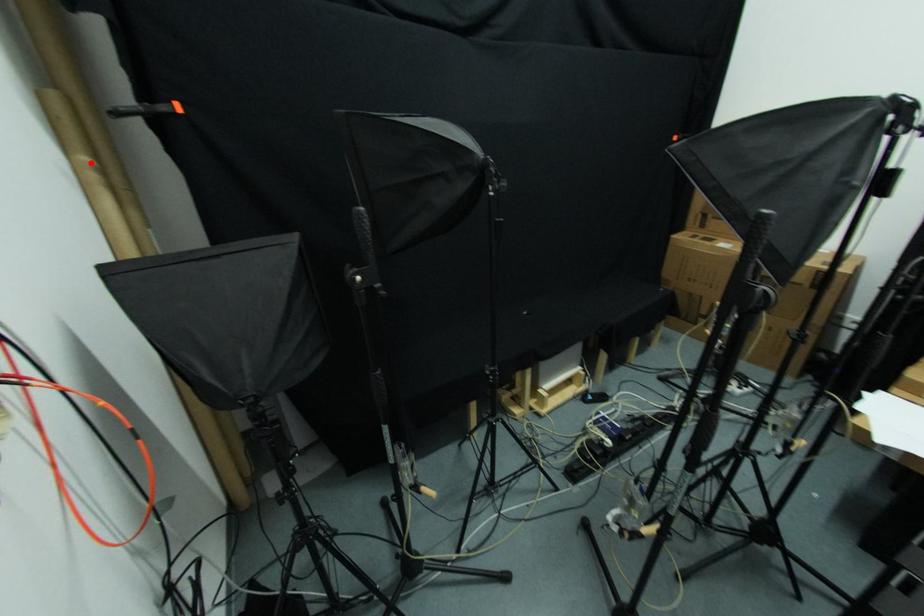
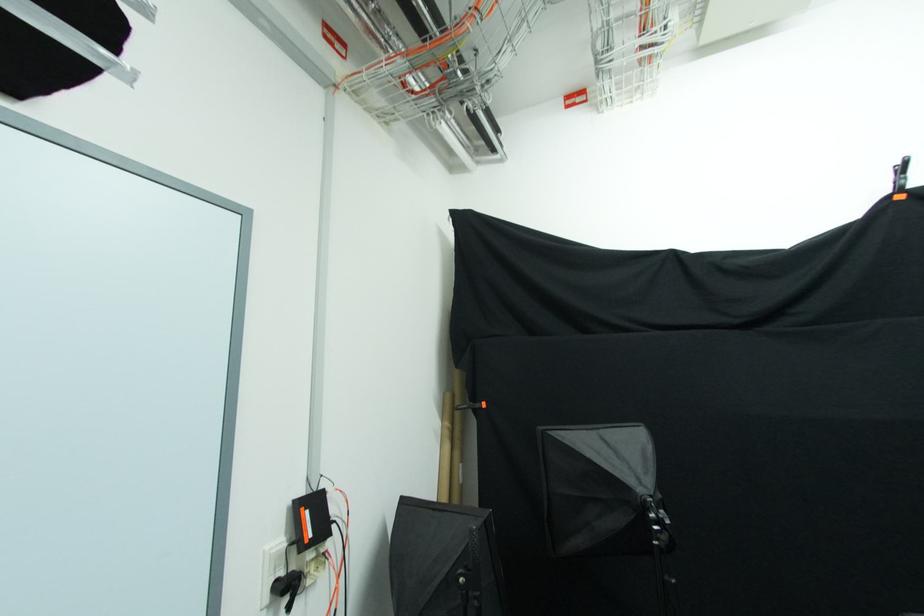
Where in the second image is the point corresponding to the highlighted location from the first image?

(448, 427)